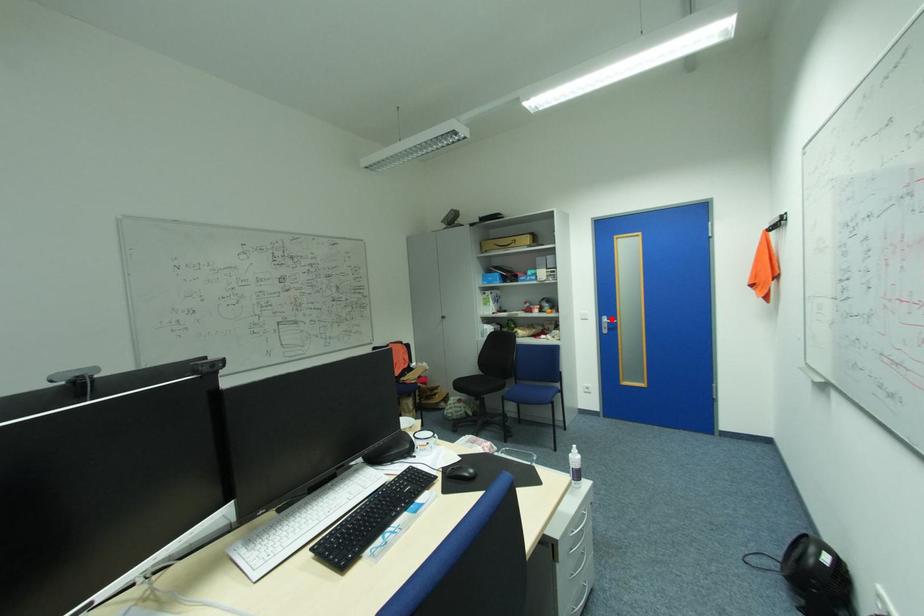
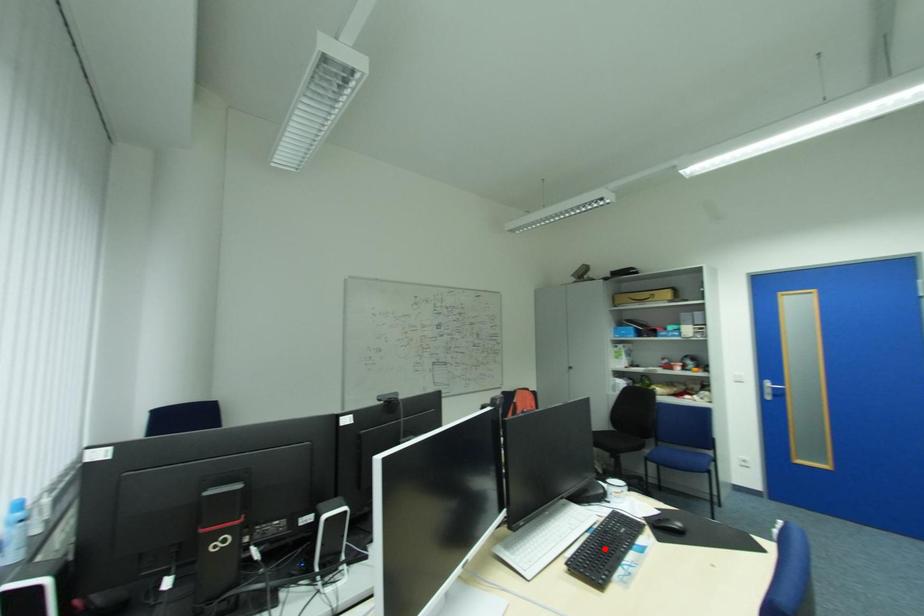
From the picture: I am providing you with two images of the same scene from different viewpoints. A red point is marked on the first image and another point is marked on the second image. Are the points marked in image1 and image2 representing the same 3D position?

No